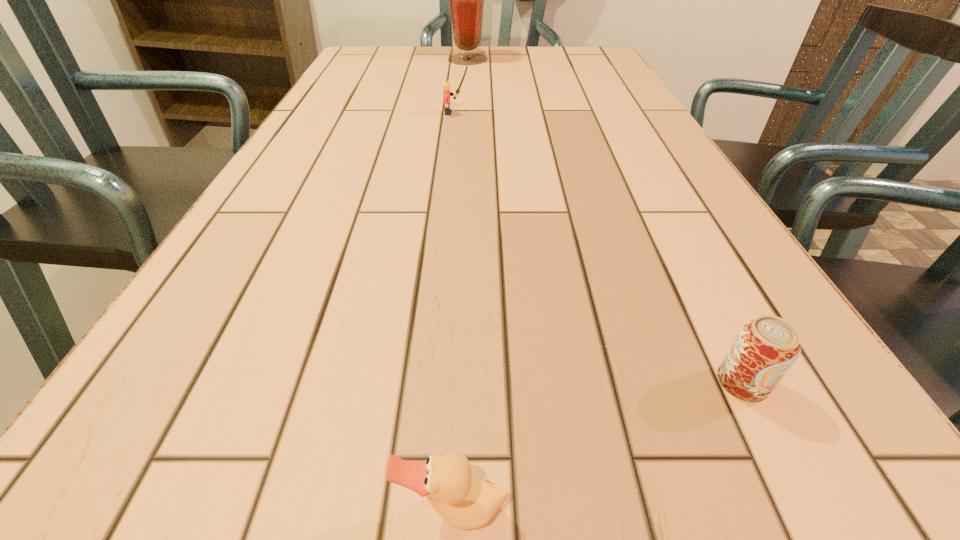
At what (x,y) coordinates should I click in order to perform the action: click on object located in the near edge section of the desktop. Please return your answer as a coordinate pair (x, y). Image resolution: width=960 pixels, height=540 pixels. Looking at the image, I should click on point(465,502).

At what (x,y) coordinates should I click in order to perform the action: click on object that is at the right edge. Please return your answer as a coordinate pair (x, y). This screenshot has width=960, height=540. Looking at the image, I should click on (766, 347).

The width and height of the screenshot is (960, 540). In the image, there is a desktop. In order to click on vacant space at the far edge in this screenshot , I will do `click(414, 66)`.

The height and width of the screenshot is (540, 960). In the image, there is a desktop. Identify the location of free space at the left edge. (266, 293).

In the image, there is a desktop. Identify the location of vacant space at the right edge. (599, 102).

You are a GUI agent. You are given a task and a screenshot of the screen. Output one action in this format:
    pyautogui.click(x=<x>, y=<y>)
    Task: Click on the vacant area at the far left corner of the desktop
    The height and width of the screenshot is (540, 960).
    Given the screenshot: What is the action you would take?
    pyautogui.click(x=399, y=60)

At what (x,y) coordinates should I click in order to perform the action: click on vacant space at the far right corner. Please return your answer as a coordinate pair (x, y). The width and height of the screenshot is (960, 540). Looking at the image, I should click on (568, 66).

Where is `vacant area that lies between the farthest object and the duck`? This screenshot has height=540, width=960. vacant area that lies between the farthest object and the duck is located at coordinates (460, 284).

The height and width of the screenshot is (540, 960). Find the location of `empty space between the second nearest object and the farthest object`. empty space between the second nearest object and the farthest object is located at coordinates (605, 220).

Find the location of a particular element. free point between the rightmost object and the Lego is located at coordinates (599, 247).